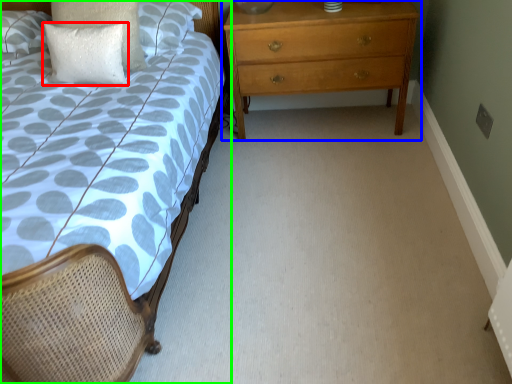
Question: Considering the real-world distances, which object is farthest from pillow (highlighted by a red box)? chest of drawers (highlighted by a blue box) or bed (highlighted by a green box)?

Choices:
 (A) chest of drawers
 (B) bed

Answer: (B)